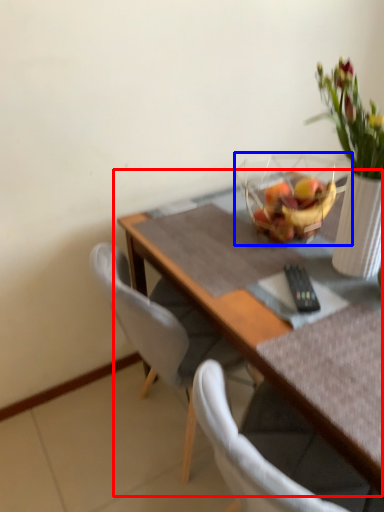
Question: Which of the following is the farthest to the observer, table (highlighted by a red box) or basket (highlighted by a blue box)?

Choices:
 (A) table
 (B) basket

Answer: (B)